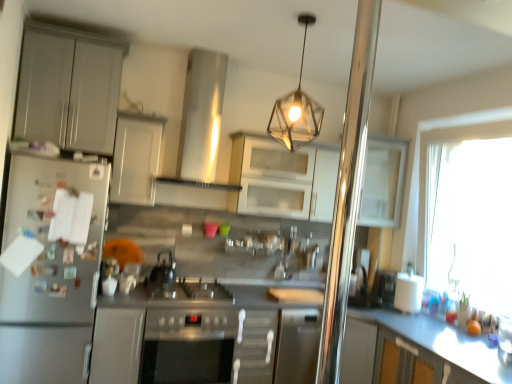
Find the location of a particular element. satin silver refrigerator at left is located at coordinates (50, 275).

The height and width of the screenshot is (384, 512). What do you see at coordinates (68, 90) in the screenshot?
I see `matte gray cabinets at upper left, placed as the 1th cabinetry when sorted from left to right` at bounding box center [68, 90].

At what (x,y) coordinates should I click in order to perform the action: click on shiny metallic kettle at center. Please return your answer as a coordinate pair (x, y). Image resolution: width=512 pixels, height=384 pixels. Looking at the image, I should click on (163, 270).

Who is shorter, transparent glass window at right or stainless steel oven at center?

Standing shorter between the two is stainless steel oven at center.

The width and height of the screenshot is (512, 384). Find the location of `window lying on the right of stainless steel oven at center`. window lying on the right of stainless steel oven at center is located at coordinates (471, 222).

Between transparent glass window at right and stainless steel oven at center, which one appears on the left side from the viewer's perspective?

Positioned to the left is stainless steel oven at center.

Is point (459, 289) in front of point (215, 358)?

No.

Considering the relative sizes of metallic hexagonal light fixture at upper center and white matte cabinet at upper center, arranged as the third cabinetry when viewed from the right, in the image provided, is metallic hexagonal light fixture at upper center wider than white matte cabinet at upper center, arranged as the third cabinetry when viewed from the right,?

Indeed, metallic hexagonal light fixture at upper center has a greater width compared to white matte cabinet at upper center, arranged as the third cabinetry when viewed from the right.

From a real-world perspective, between metallic hexagonal light fixture at upper center and white matte cabinet at upper center, arranged as the third cabinetry when viewed from the right, who is vertically higher?

From a 3D spatial view, metallic hexagonal light fixture at upper center is above.

Considering the sizes of objects metallic hexagonal light fixture at upper center and white matte cabinet at upper center, arranged as the third cabinetry when viewed from the right, in the image provided, who is smaller, metallic hexagonal light fixture at upper center or white matte cabinet at upper center, arranged as the third cabinetry when viewed from the right,?

white matte cabinet at upper center, arranged as the third cabinetry when viewed from the right, is smaller.

Looking at their sizes, would you say stainless steel oven at center is wider or thinner than white glossy cabinet at center, acting as the 2th cabinetry starting from the right?

stainless steel oven at center is wider than white glossy cabinet at center, acting as the 2th cabinetry starting from the right.

Which point is more forward, (213, 330) or (237, 172)?

The point (213, 330) is in front.

Considering the sizes of objects stainless steel oven at center and white glossy cabinet at center, arranged as the fourth cabinetry when viewed from the left, in the image provided, who is taller, stainless steel oven at center or white glossy cabinet at center, arranged as the fourth cabinetry when viewed from the left,?

stainless steel oven at center is taller.

You are a GUI agent. You are given a task and a screenshot of the screen. Output one action in this format:
    pyautogui.click(x=<x>, y=<y>)
    Task: Click on the oven on the left side of white glossy cabinet at center, arranged as the fourth cabinetry when viewed from the left
    
    Given the screenshot: What is the action you would take?
    pyautogui.click(x=188, y=347)

Looking at this image, are stainless steel oven at center and polished chrome glass door at center beside each other?

No, stainless steel oven at center is not touching polished chrome glass door at center.

Which object is wider, stainless steel oven at center or polished chrome glass door at center?

stainless steel oven at center.

Which point is more distant from viewer, (234, 330) or (350, 221)?

Positioned behind is point (234, 330).

From the image's perspective, is metallic hexagonal light fixture at upper center above white glossy countertop at lower right?

Yes.

Is metallic hexagonal light fixture at upper center facing away from white glossy countertop at lower right?

No, metallic hexagonal light fixture at upper center is not facing away from white glossy countertop at lower right.

From a real-world perspective, which object stands above the other?

metallic hexagonal light fixture at upper center is physically above.

How far apart are shiny metallic kettle at center and matte gray cabinets at upper left, placed as the 1th cabinetry when sorted from left to right?

The distance of shiny metallic kettle at center from matte gray cabinets at upper left, placed as the 1th cabinetry when sorted from left to right, is 4.22 feet.

Considering the relative positions of shiny metallic kettle at center and matte gray cabinets at upper left, positioned as the 5th cabinetry in right-to-left order, in the image provided, is shiny metallic kettle at center in front of matte gray cabinets at upper left, positioned as the 5th cabinetry in right-to-left order,?

No, shiny metallic kettle at center is behind matte gray cabinets at upper left, positioned as the 5th cabinetry in right-to-left order.

Who is taller, shiny metallic kettle at center or matte gray cabinets at upper left, positioned as the 5th cabinetry in right-to-left order?

With more height is matte gray cabinets at upper left, positioned as the 5th cabinetry in right-to-left order.

Is shiny metallic kettle at center inside or outside of matte gray cabinets at upper left, placed as the 1th cabinetry when sorted from left to right?

shiny metallic kettle at center is located beyond the bounds of matte gray cabinets at upper left, placed as the 1th cabinetry when sorted from left to right.

Is matte gray cabinet at lower center, the 4th cabinetry from the right, not inside satin silver refrigerator at left?

Yes, matte gray cabinet at lower center, the 4th cabinetry from the right, is outside of satin silver refrigerator at left.

Considering the sizes of objects matte gray cabinet at lower center, the 4th cabinetry from the right, and satin silver refrigerator at left in the image provided, who is smaller, matte gray cabinet at lower center, the 4th cabinetry from the right, or satin silver refrigerator at left?

matte gray cabinet at lower center, the 4th cabinetry from the right, is smaller.

Is the position of matte gray cabinet at lower center, the 4th cabinetry from the right, more distant than that of satin silver refrigerator at left?

That is True.

Is matte gray cabinet at lower center, acting as the second cabinetry starting from the left, taller than satin silver refrigerator at left?

No.

Where is `oven that is behind the transparent glass window at right`? The height and width of the screenshot is (384, 512). oven that is behind the transparent glass window at right is located at coordinates [188, 347].

From a real-world perspective, count 4th cabinetrys downward from the metallic hexagonal light fixture at upper center and point to it. Please provide its 2D coordinates.

[(136, 158)]

When comparing their distances from shiny metallic kettle at center, does satin silver refrigerator at left or white glossy cabinet at upper right, the fifth cabinetry in the left-to-right sequence, seem further?

The object further to shiny metallic kettle at center is white glossy cabinet at upper right, the fifth cabinetry in the left-to-right sequence.

Based on their spatial positions, is satin silver refrigerator at left or white glossy cabinet at upper right, arranged as the 1th cabinetry when viewed from the right, further from white glossy countertop at lower right?

Based on the image, satin silver refrigerator at left appears to be further to white glossy countertop at lower right.

In the scene shown: When comparing their distances from white glossy cabinet at upper right, arranged as the 1th cabinetry when viewed from the right, does transparent glass window at right or shiny metallic kettle at center seem further?

Among the two, shiny metallic kettle at center is located further to white glossy cabinet at upper right, arranged as the 1th cabinetry when viewed from the right.

Looking at the image, which one is located further to white glossy countertop at lower right, white glossy cabinet at center, acting as the 2th cabinetry starting from the right, or white matte cabinet at upper center, which is the 3th cabinetry from left to right?

white matte cabinet at upper center, which is the 3th cabinetry from left to right, is further to white glossy countertop at lower right.

In the scene shown: Which object lies nearer to the anchor point metallic hexagonal light fixture at upper center, matte gray cabinet at lower center, the 4th cabinetry from the right, or satin silver exhaust hood at upper center?

satin silver exhaust hood at upper center lies closer to metallic hexagonal light fixture at upper center than the other object.

Looking at the image, which one is located closer to white glossy cabinet at center, acting as the 2th cabinetry starting from the right, white matte cabinet at upper center, which is the 3th cabinetry from left to right, or shiny metallic kettle at center?

The object closer to white glossy cabinet at center, acting as the 2th cabinetry starting from the right, is white matte cabinet at upper center, which is the 3th cabinetry from left to right.

Considering their positions, is satin silver exhaust hood at upper center positioned closer to white glossy cabinet at center, acting as the 2th cabinetry starting from the right, than white glossy countertop at lower right?

The object closer to white glossy cabinet at center, acting as the 2th cabinetry starting from the right, is satin silver exhaust hood at upper center.

Which object lies further to the anchor point shiny metallic kettle at center, white glossy countertop at lower right or satin silver refrigerator at left?

white glossy countertop at lower right.

The image size is (512, 384). What are the coordinates of `appliance between satin silver refrigerator at left and white glossy countertop at lower right in the horizontal direction` in the screenshot? It's located at (163, 270).

Identify the location of oven between polished chrome glass door at center and white glossy cabinet at center, acting as the 2th cabinetry starting from the right, in the front-back direction. The width and height of the screenshot is (512, 384). (188, 347).

Locate an element on the screen. Image resolution: width=512 pixels, height=384 pixels. kitchen appliance between white matte cabinet at upper center, which is the 3th cabinetry from left to right, and matte gray cabinet at lower center, the 4th cabinetry from the right, from top to bottom is located at coordinates (50, 275).

Where is `appliance between matte gray cabinet at lower center, the 4th cabinetry from the right, and white glossy cabinet at upper right, arranged as the 1th cabinetry when viewed from the right`? appliance between matte gray cabinet at lower center, the 4th cabinetry from the right, and white glossy cabinet at upper right, arranged as the 1th cabinetry when viewed from the right is located at coordinates (163, 270).